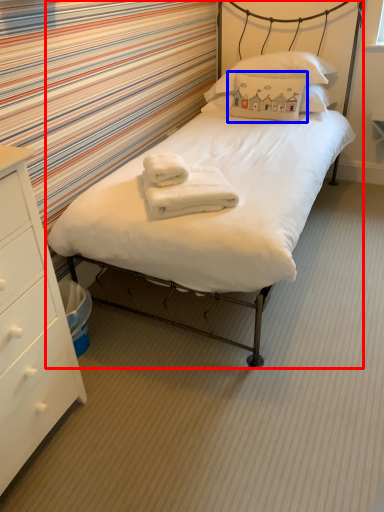
Question: Which object appears closest to the camera in this image, bed (highlighted by a red box) or pillow (highlighted by a blue box)?

Choices:
 (A) bed
 (B) pillow

Answer: (A)